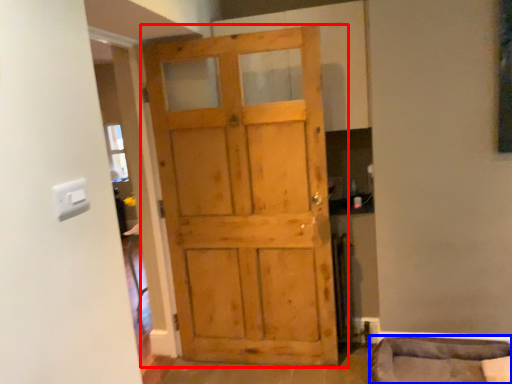
Question: Among these objects, which one is nearest to the camera, door (highlighted by a red box) or furniture (highlighted by a blue box)?

Choices:
 (A) door
 (B) furniture

Answer: (B)